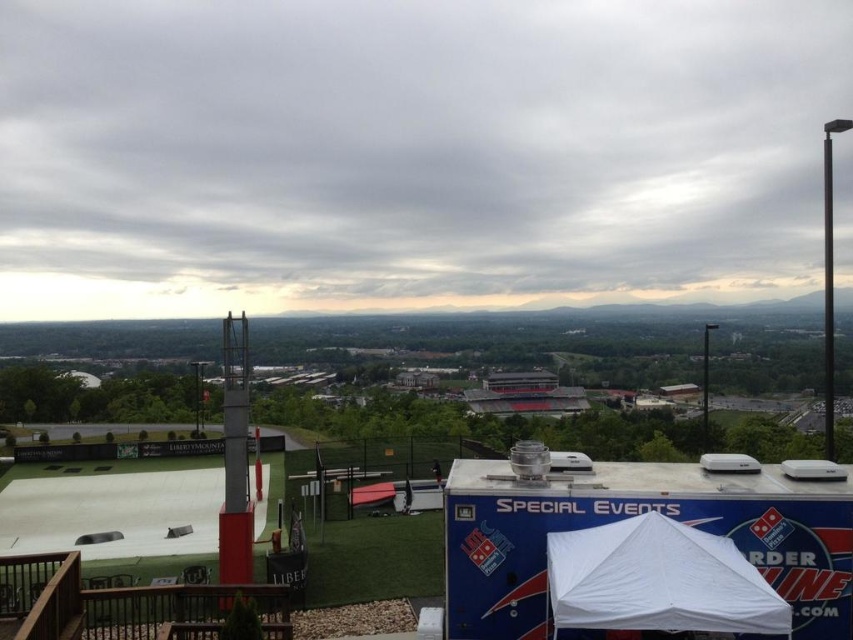
Looking at this image, you are attending an outdoor event and want to find the main entrance. You see the red brick stadium at center and the white fabric canopy at lower right. Which object is closer to the main entrance based on their positions?

The red brick stadium at center is positioned on the left side of white fabric canopy at lower right, so the white fabric canopy at lower right is closer to the main entrance since it is positioned to the right of the stadium.

You are planning to set up a new tent for an event. The current setup includes a red brick stadium at center and a white fabric canopy at lower right. Which object should you consider in terms of width to ensure your new tent doesn

The red brick stadium at center might be wider than the white fabric canopy at lower right, so you should consider the width of the red brick stadium at center to ensure your new tent accommodates the space properly.